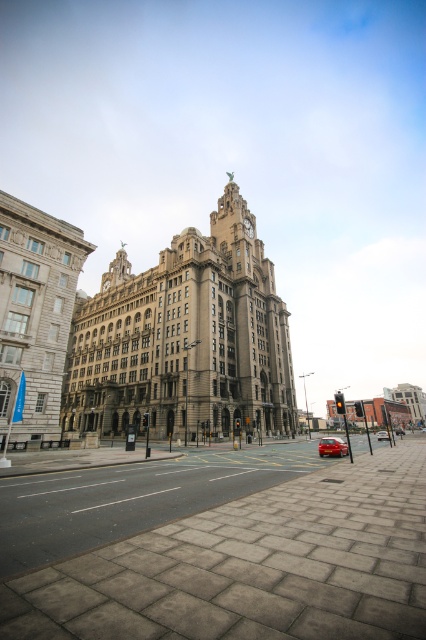
Question: Is shiny red car at center below metallic red car at center?

Choices:
 (A) yes
 (B) no

Answer: (B)

Question: Is shiny red car at center positioned before shiny red sedan at center?

Choices:
 (A) yes
 (B) no

Answer: (A)

Question: Which of these objects is positioned farthest from the shiny red sedan at center?

Choices:
 (A) metallic red car at center
 (B) shiny red car at center

Answer: (B)

Question: Which point is closer to the camera taking this photo?

Choices:
 (A) (325, 448)
 (B) (385, 435)

Answer: (A)

Question: Which of the following is the farthest from the observer?

Choices:
 (A) shiny red car at center
 (B) shiny red sedan at center
 (C) metallic red car at center

Answer: (B)

Question: Can you confirm if metallic red car at center is positioned below shiny red sedan at center?

Choices:
 (A) yes
 (B) no

Answer: (B)